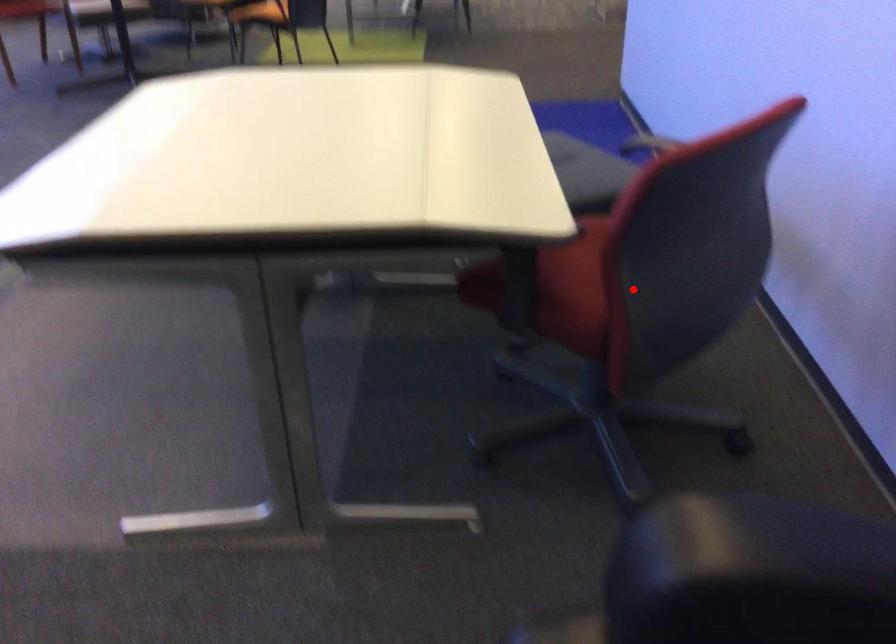
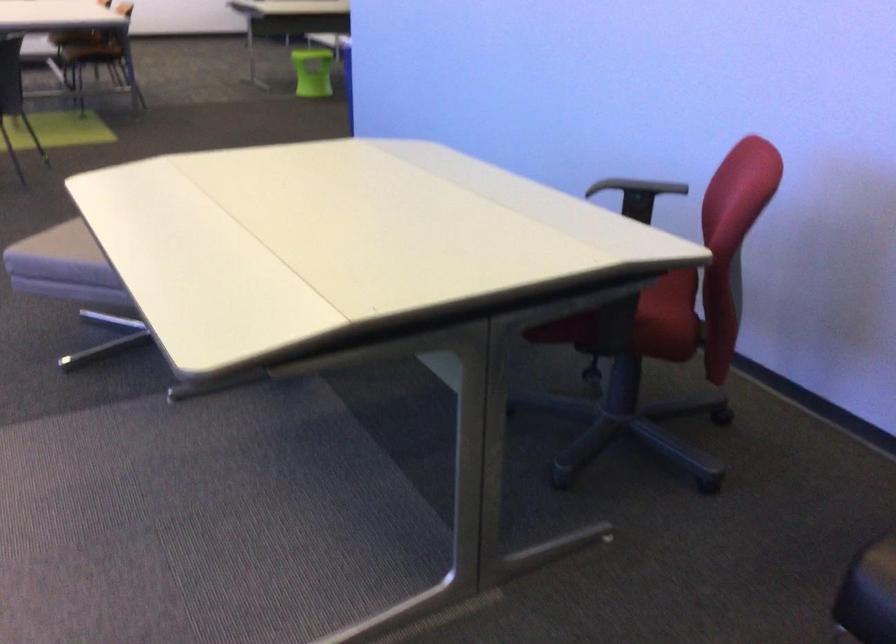
Locate, in the second image, the point that corresponds to the highlighted location in the first image.

(669, 299)